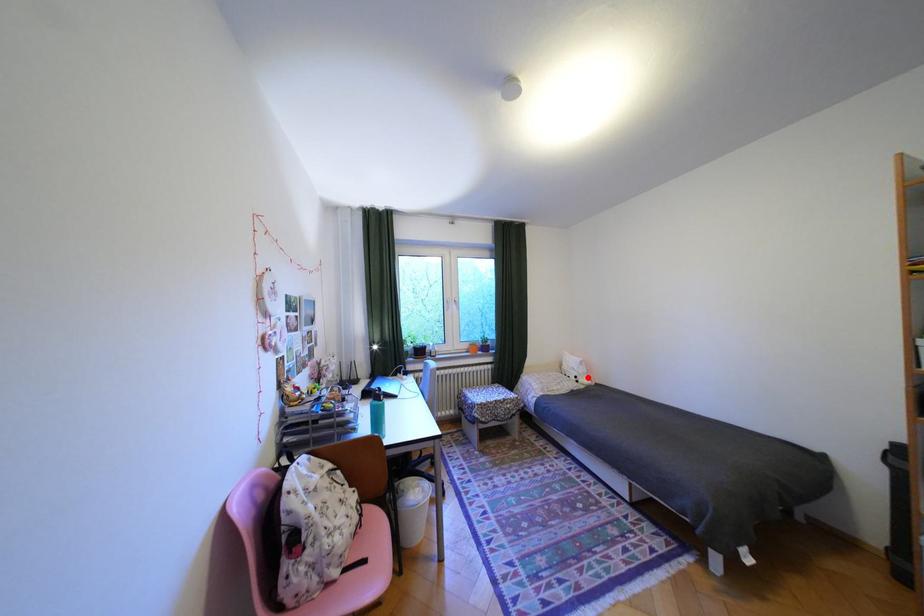
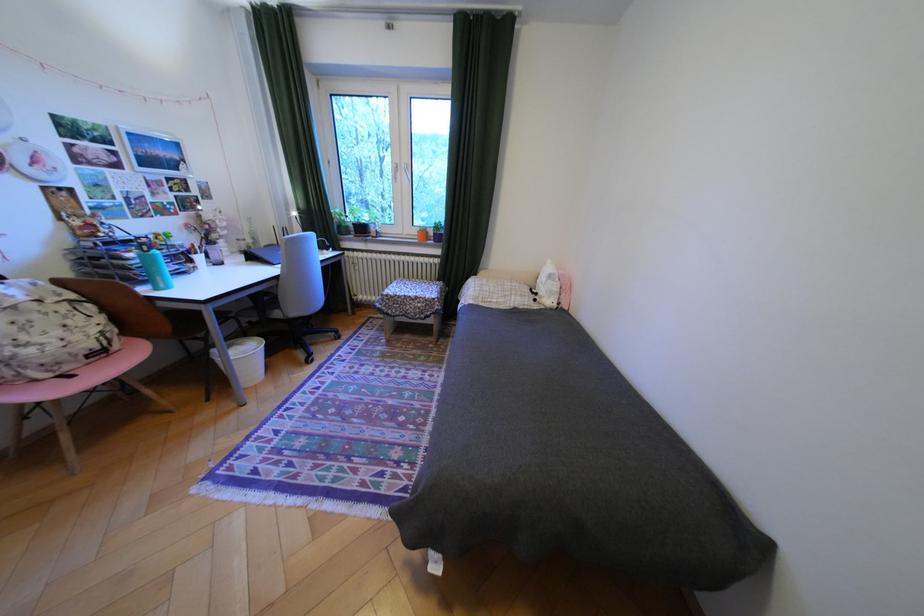
The point at the highlighted location is marked in the first image. Where is the corresponding point in the second image?

(548, 294)